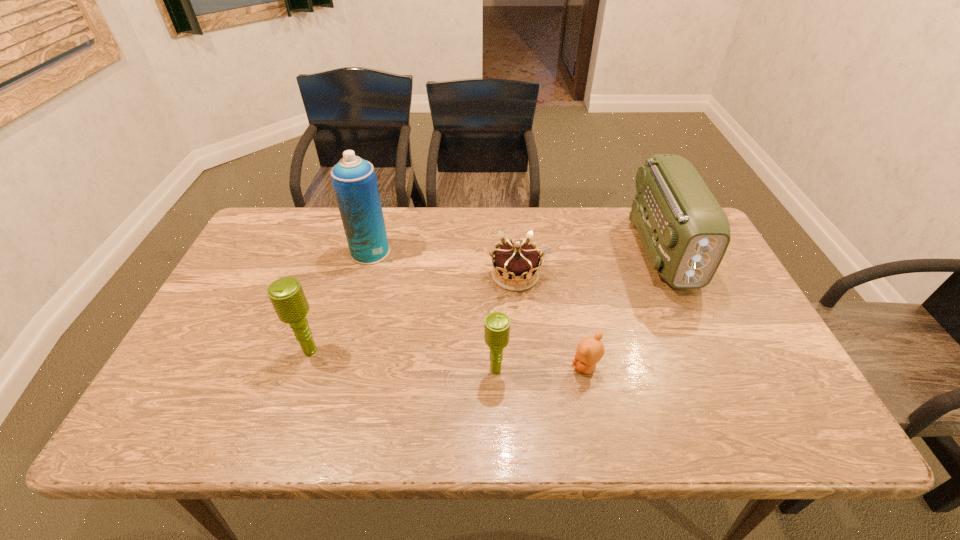
Find the location of a particular element. the taller microphone is located at coordinates (286, 294).

Image resolution: width=960 pixels, height=540 pixels. Find the location of `the shorter microphone`. the shorter microphone is located at coordinates (497, 324).

Identify the location of the right microphone. (497, 324).

Find the location of `the rightmost object`. the rightmost object is located at coordinates (685, 232).

Locate an element on the screen. The height and width of the screenshot is (540, 960). the tallest object is located at coordinates (354, 180).

Image resolution: width=960 pixels, height=540 pixels. In order to click on crown in this screenshot , I will do `click(518, 261)`.

This screenshot has width=960, height=540. What are the coordinates of `the second object from right to left` in the screenshot? It's located at (590, 350).

Locate an element on the screen. free space located on the back of the taller microphone is located at coordinates (342, 259).

Find the location of `vacant space located 0.210m on the right of the shorter microphone`. vacant space located 0.210m on the right of the shorter microphone is located at coordinates (596, 370).

Image resolution: width=960 pixels, height=540 pixels. I want to click on vacant space located 0.270m on the front-facing side of the radio_receiver, so click(722, 380).